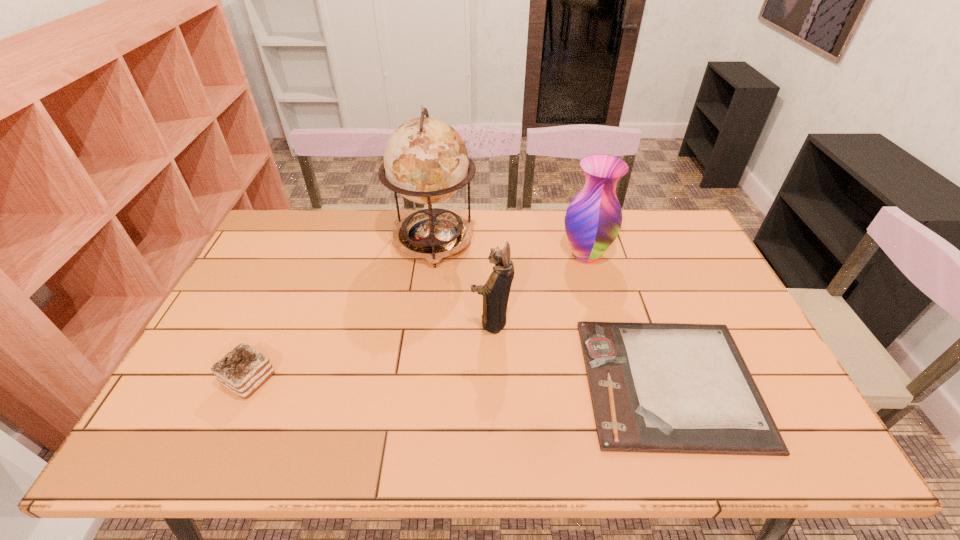
I want to click on blank area at the near edge, so (457, 428).

The width and height of the screenshot is (960, 540). Identify the location of vacant region at the left edge of the desktop. (280, 282).

Identify the location of vacant space at the right edge. [734, 309].

Where is `free space at the far left corner of the desktop`? This screenshot has height=540, width=960. free space at the far left corner of the desktop is located at coordinates (300, 246).

Where is `free space at the far right corner of the desktop`? This screenshot has width=960, height=540. free space at the far right corner of the desktop is located at coordinates (648, 220).

Where is `free space that is in between the figurine and the chocolate cake`? free space that is in between the figurine and the chocolate cake is located at coordinates (371, 350).

The height and width of the screenshot is (540, 960). In order to click on free space between the vase and the leftmost object in this screenshot , I will do `click(418, 317)`.

Locate an element on the screen. The width and height of the screenshot is (960, 540). vacant space that is in between the vase and the second shortest object is located at coordinates (418, 317).

I want to click on vacant space that's between the globe and the leftmost object, so click(341, 310).

Identify the location of free space between the globe and the chocolate cake. (341, 310).